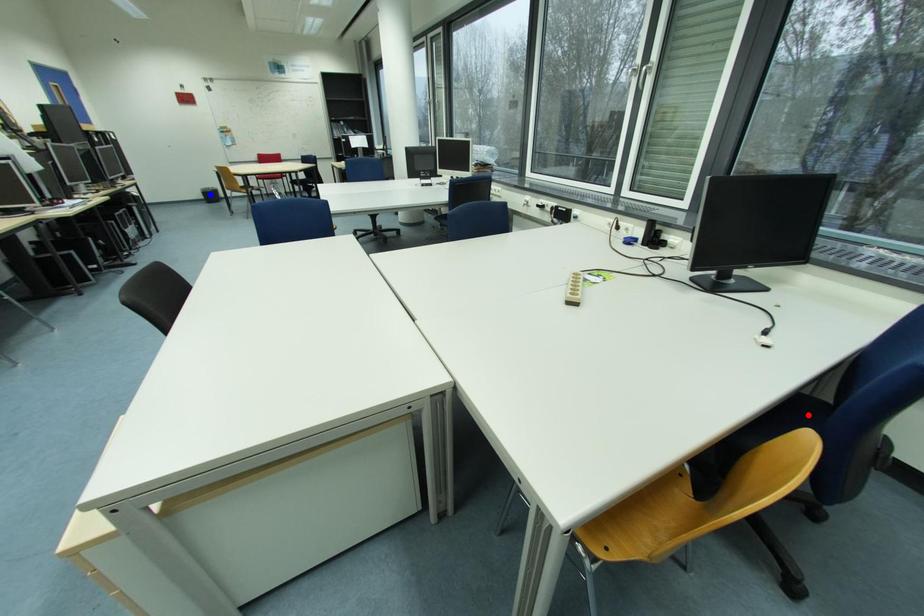
Question: In the image, two points are highlighted. Which point is nearer to the camera? Reply with the corresponding letter.

Choices:
 (A) blue point
 (B) red point

Answer: (B)